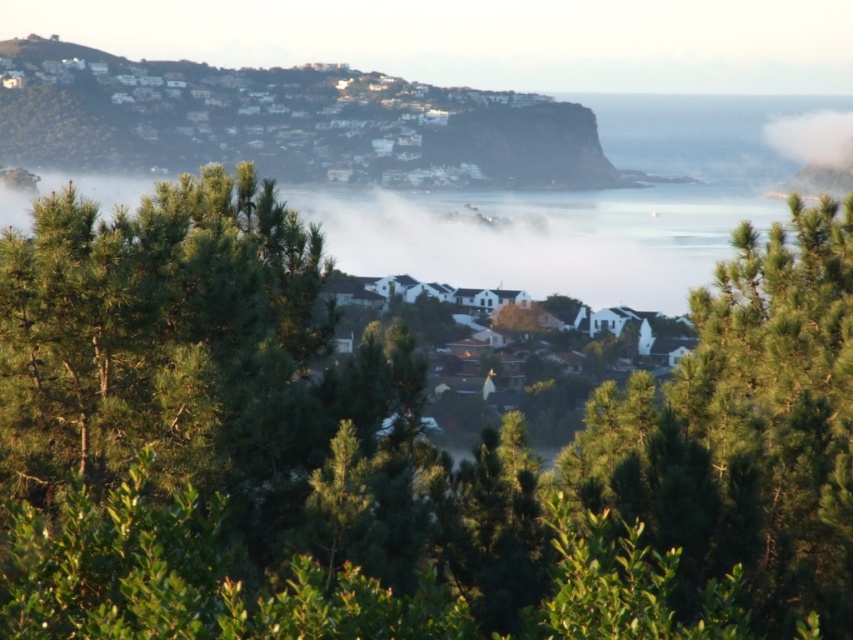
You are a photographer planning to capture the coastal view. You notice two groups of white matte houses at upper left and white matte houses at center. Which group would appear taller in your photo?

The white matte houses at upper left appear taller in the photo because they have a greater height compared to the white matte houses at center.

Looking at this image, you are an architect designing a new housing development. You want to ensure that the houses you design will be visible from the coastal path that runs along the edge of the forest. Given the scene described, which object between the white matte houses at center and the white fluffy cloud at upper right is more likely to be obscured by the dense pine trees and vegetation?

The white matte houses at center are larger in size compared to the white fluffy cloud at upper right, so they are more likely to be obscured by the dense pine trees and vegetation since their larger size makes them more prone to being blocked by the foliage.

You are a real estate agent showing a client around this coastal area. You point out two groups of houses in the scene. The first group is the white matte houses at upper left, and the second group is the white matte houses at center. The client asks which group of houses appears larger in the image. What do you tell them?

The white matte houses at upper left appears larger in the image than the white matte houses at center.